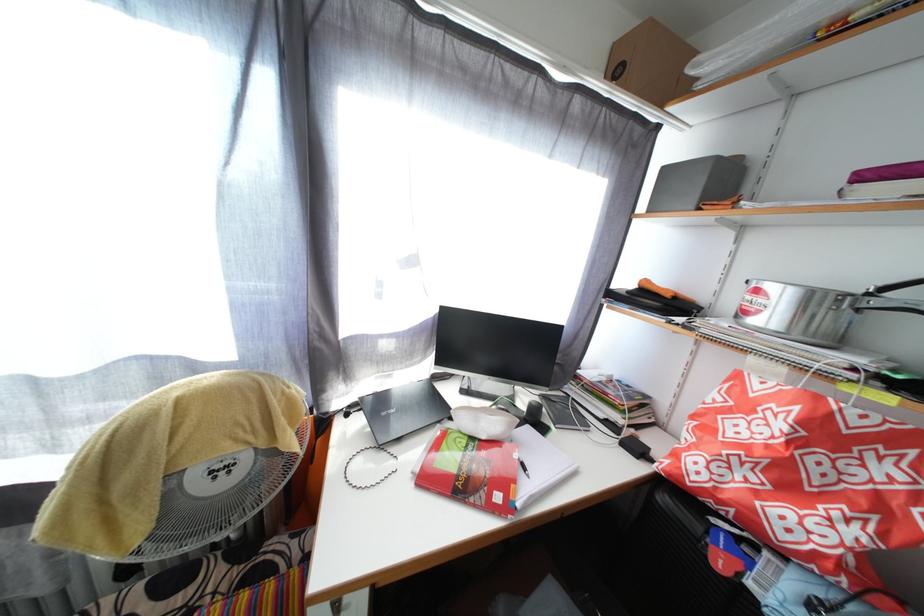
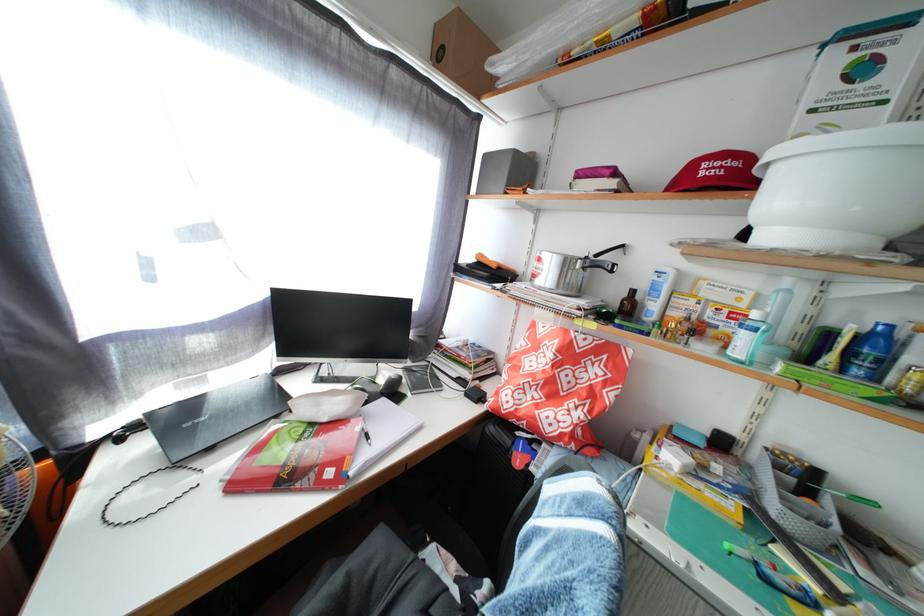
Locate, in the second image, the point that corresponds to [675,176] in the first image.

(494, 163)